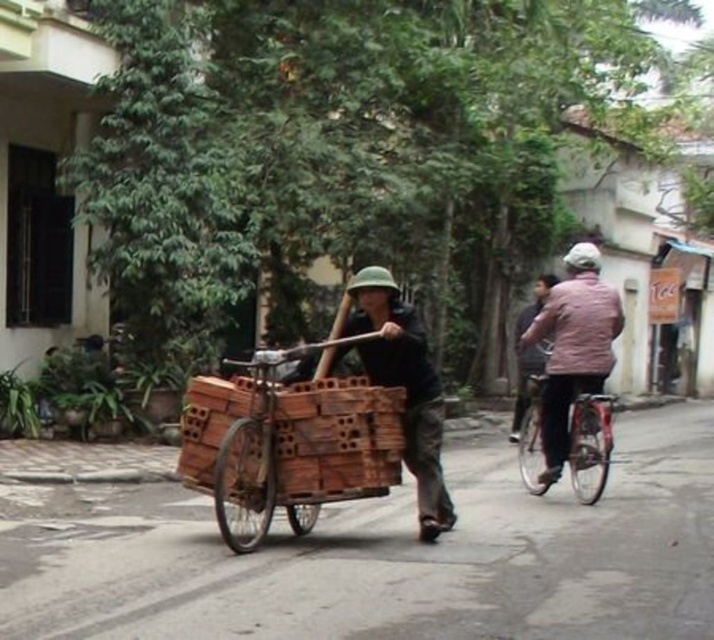
Between point (533, 444) and point (538, 285), which one is positioned in front?

Point (533, 444)

Does point (521, 452) come in front of point (543, 292)?

Yes, it is.

You are a GUI agent. You are given a task and a screenshot of the screen. Output one action in this format:
    pyautogui.click(x=<x>, y=<y>)
    Task: Click on the metallic silver bicycle at right
    
    Given the screenshot: What is the action you would take?
    pyautogui.click(x=588, y=444)

Between wooden cart at center and pink fabric shirt at right, which one appears on the left side from the viewer's perspective?

From the viewer's perspective, wooden cart at center appears more on the left side.

Describe the element at coordinates (286, 445) in the screenshot. I see `wooden cart at center` at that location.

Between point (368, 445) and point (545, 275), which one is positioned behind?

Positioned behind is point (545, 275).

Where is `wooden cart at center`? The height and width of the screenshot is (640, 714). wooden cart at center is located at coordinates (286, 445).

Who is positioned more to the right, wooden helmet at center or pink fabric shirt at right?

Positioned to the right is pink fabric shirt at right.

You are a GUI agent. You are given a task and a screenshot of the screen. Output one action in this format:
    pyautogui.click(x=<x>, y=<y>)
    Task: Click on the wooden helmet at center
    
    Given the screenshot: What is the action you would take?
    pyautogui.click(x=401, y=381)